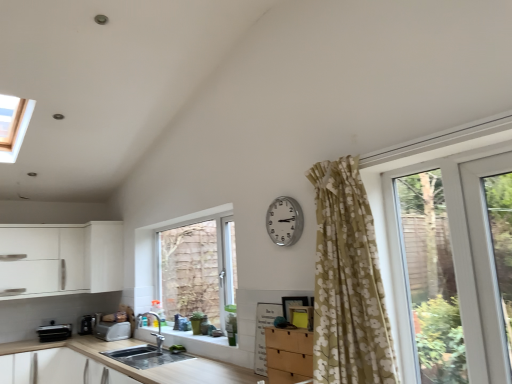
Question: Should I look upward or downward to see metallic silver toaster at lower left, the second appliance viewed from the left?

Choices:
 (A) down
 (B) up

Answer: (A)

Question: Does white plastic toaster at lower left, acting as the 3th appliance starting from the left, appear on the left side of white matte cabinet at left?

Choices:
 (A) no
 (B) yes

Answer: (A)

Question: Is white plastic toaster at lower left, the first appliance in the right-to-left sequence, not close to white matte cabinet at left?

Choices:
 (A) no
 (B) yes

Answer: (A)

Question: From the image's perspective, is white plastic toaster at lower left, the first appliance in the right-to-left sequence, located above white matte cabinet at left?

Choices:
 (A) no
 (B) yes

Answer: (A)

Question: From a real-world perspective, is white plastic toaster at lower left, acting as the 3th appliance starting from the left, positioned under white matte cabinet at left based on gravity?

Choices:
 (A) no
 (B) yes

Answer: (B)

Question: Is white matte cabinet at left a part of white plastic toaster at lower left, acting as the 3th appliance starting from the left?

Choices:
 (A) no
 (B) yes

Answer: (A)

Question: Does white plastic toaster at lower left, the first appliance in the right-to-left sequence, have a smaller size compared to white matte cabinet at left?

Choices:
 (A) no
 (B) yes

Answer: (B)

Question: Does white matte cabinet at left have a larger size compared to white plastic screen door at right?

Choices:
 (A) no
 (B) yes

Answer: (B)

Question: Considering the relative sizes of white matte cabinet at left and white plastic screen door at right in the image provided, is white matte cabinet at left smaller than white plastic screen door at right?

Choices:
 (A) yes
 (B) no

Answer: (B)

Question: From a real-world perspective, is white matte cabinet at left positioned under white plastic screen door at right based on gravity?

Choices:
 (A) no
 (B) yes

Answer: (A)

Question: From the image's perspective, is white matte cabinet at left under white plastic screen door at right?

Choices:
 (A) no
 (B) yes

Answer: (B)

Question: Is white matte cabinet at left facing towards white plastic screen door at right?

Choices:
 (A) no
 (B) yes

Answer: (A)

Question: Would you say white plastic screen door at right is part of white matte cabinet at left's contents?

Choices:
 (A) no
 (B) yes

Answer: (A)

Question: Considering the relative sizes of metallic silver toaster at lower left, the second appliance viewed from the left, and smooth concrete sink at lower center in the image provided, is metallic silver toaster at lower left, the second appliance viewed from the left, smaller than smooth concrete sink at lower center?

Choices:
 (A) yes
 (B) no

Answer: (B)